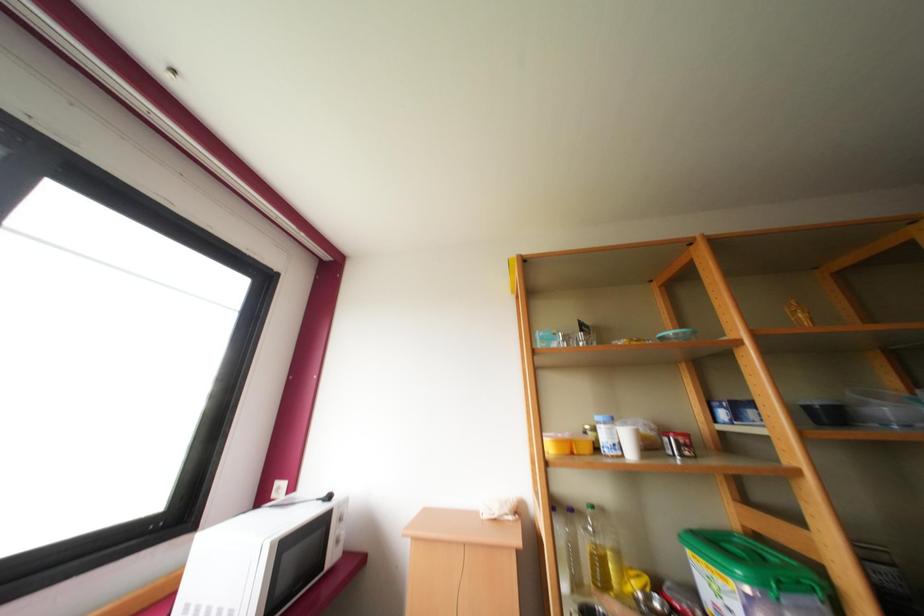
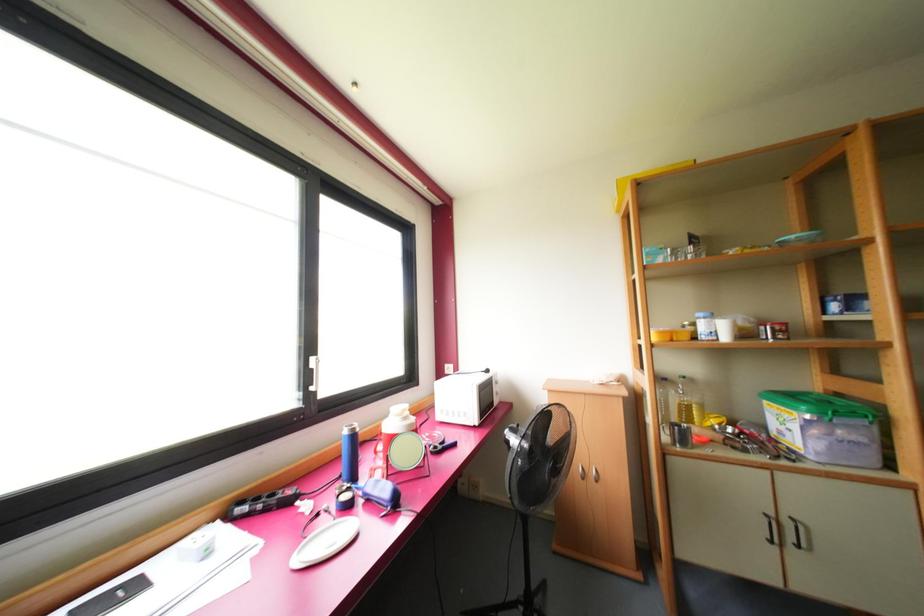
From the picture: Which direction would the cameraman need to move to produce the second image?

The cameraman walked toward left, backward.